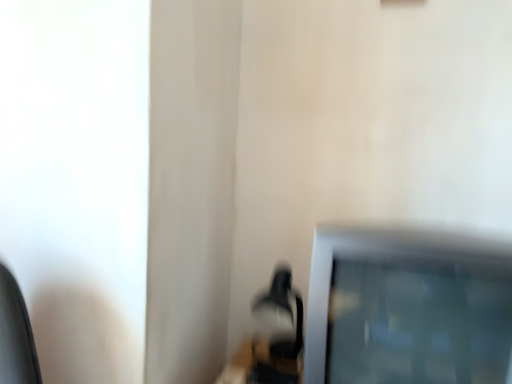
Question: From the image's perspective, is matte black table lamp at lower center positioned above or below satin silver television at lower right?

Choices:
 (A) below
 (B) above

Answer: (A)

Question: Considering the positions of point (282, 355) and point (460, 360), is point (282, 355) closer or farther from the camera than point (460, 360)?

Choices:
 (A) closer
 (B) farther

Answer: (B)

Question: Do you think matte black table lamp at lower center is within satin silver television at lower right, or outside of it?

Choices:
 (A) inside
 (B) outside

Answer: (B)

Question: In terms of size, does satin silver television at lower right appear bigger or smaller than matte black table lamp at lower center?

Choices:
 (A) small
 (B) big

Answer: (B)

Question: Considering the positions of satin silver television at lower right and matte black table lamp at lower center in the image, is satin silver television at lower right taller or shorter than matte black table lamp at lower center?

Choices:
 (A) tall
 (B) short

Answer: (A)

Question: From a real-world perspective, is satin silver television at lower right positioned above or below matte black table lamp at lower center?

Choices:
 (A) above
 (B) below

Answer: (A)

Question: Would you say satin silver television at lower right is inside or outside matte black table lamp at lower center?

Choices:
 (A) outside
 (B) inside

Answer: (A)